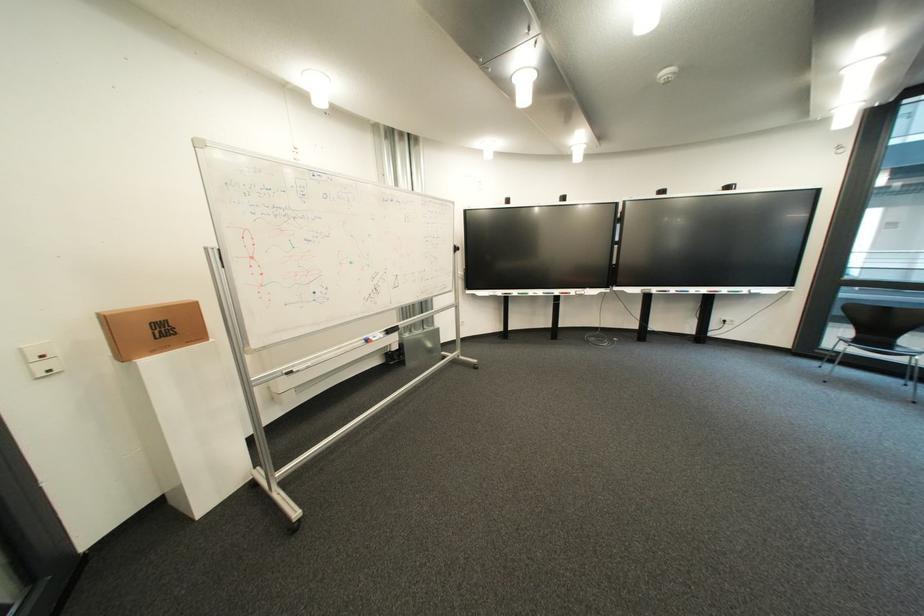
The width and height of the screenshot is (924, 616). Find the location of `chair sitting surface`. chair sitting surface is located at coordinates (873, 341).